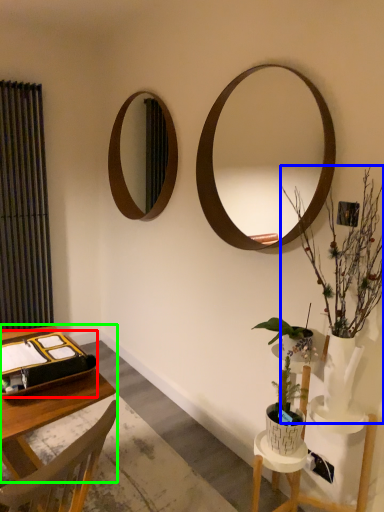
Question: Estimate the real-world distances between objects in this image. Which object is farther from binder (highlighted by a red box), houseplant (highlighted by a blue box) or vanity (highlighted by a green box)?

Choices:
 (A) houseplant
 (B) vanity

Answer: (A)